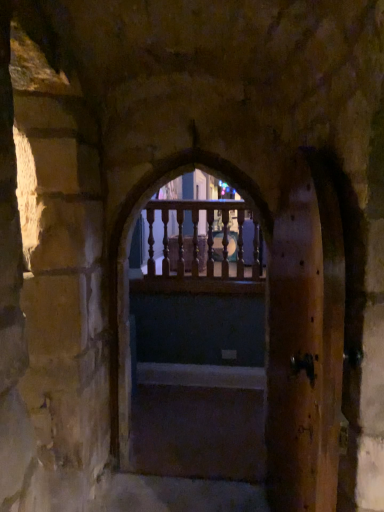
The image size is (384, 512). I want to click on vacant region below wooden railing at center (from a real-world perspective), so click(x=173, y=464).